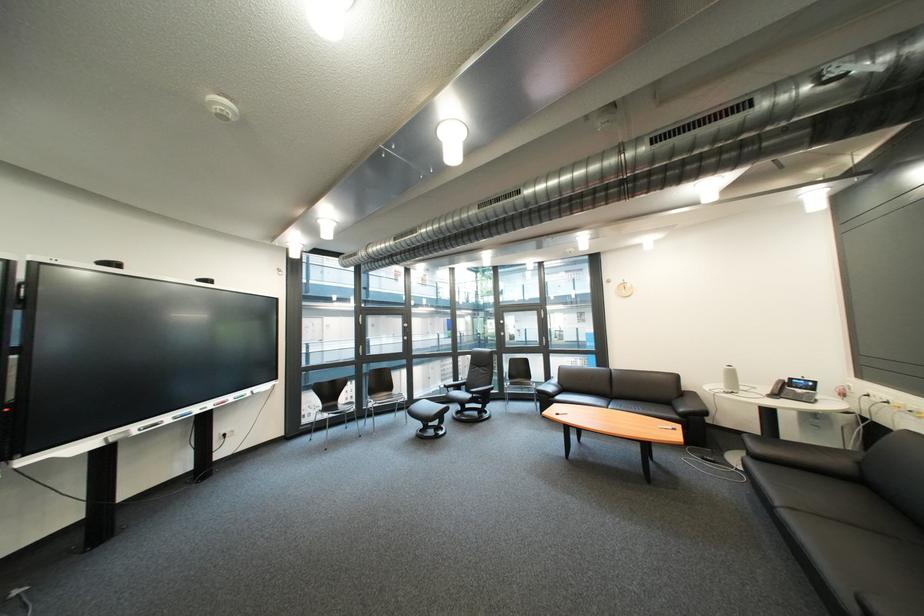
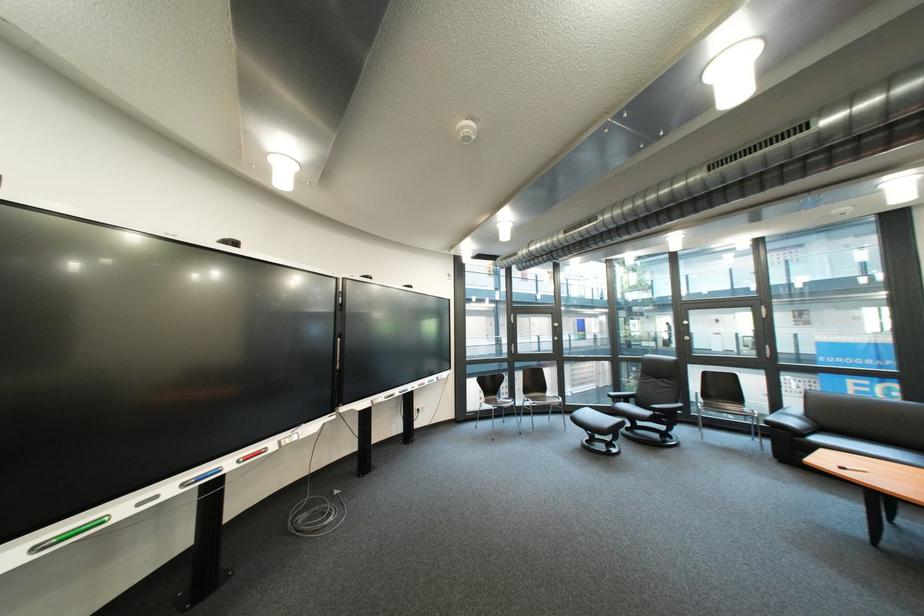
Find the pixel in the second image that matches pixel 573 384 in the first image.

(822, 418)